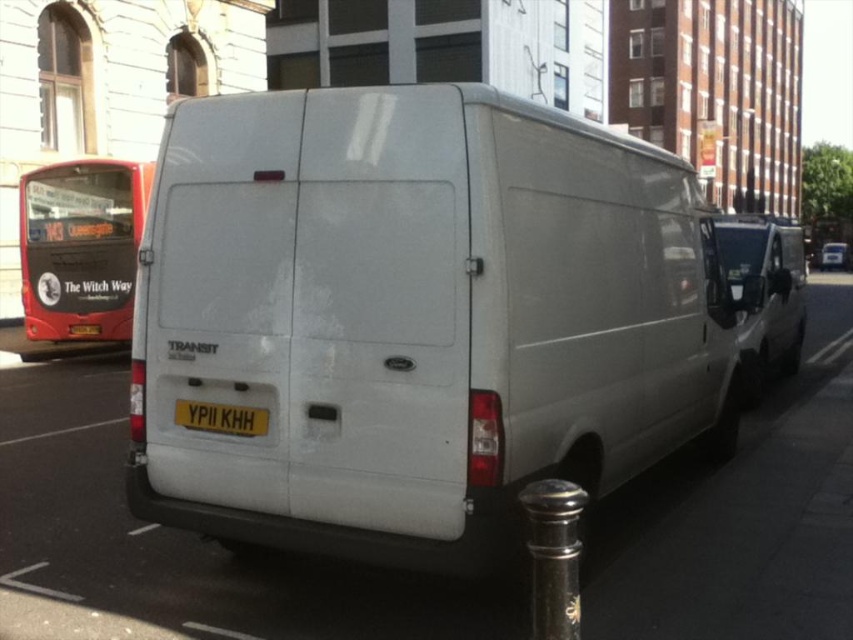
You are standing at the point with coordinates point (80, 248). What object are you facing?

The point (80, 248) indicates a red painted metal bus at left, so you are facing the red painted metal bus at left.

You are standing on the pavement next to the dark bollard. You want to walk to the white matte van at center. Which direction should you walk? The van is at point (415, 317). You are at the bollard. The pavement has markings for parking spaces. The van is a standard panel van with no rear windows. The scene includes a red double decker bus in the background.

The white matte van at center is located at point (415, 317). Since you are at the bollard on the pavement, you should walk towards the center of the pavement where the van is parked. The van is directly in front of you if you face the street, so walk straight ahead towards the van.

Looking at this image, you are a pedestrian standing on the sidewalk. You see a red painted metal bus at left and a white matte van at right. Which vehicle is closer to you?

The red painted metal bus at left is closer to you because it is positioned over the white matte van at right, indicating it is in front.